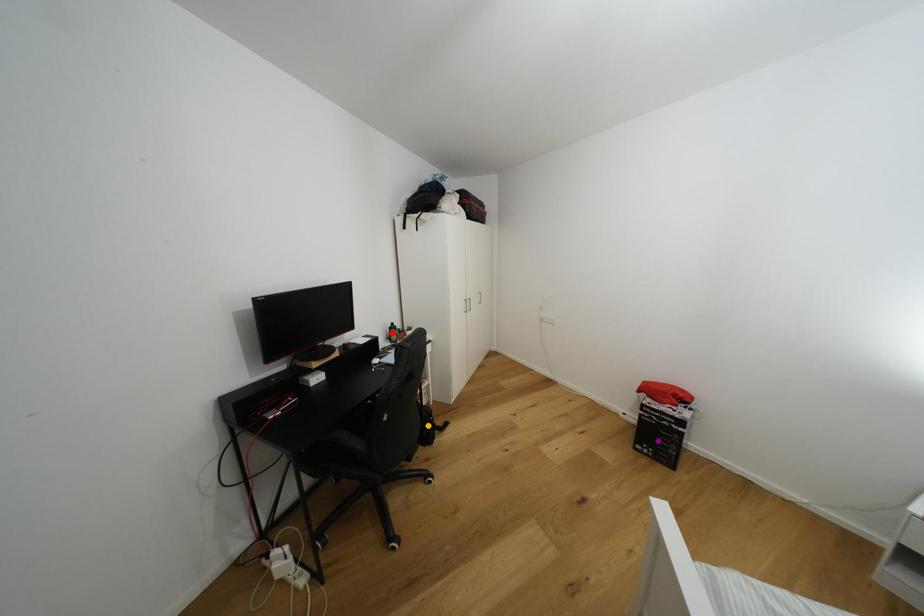
Order these from nearest to farthest:
red point | purple point | orange point

purple point < orange point < red point